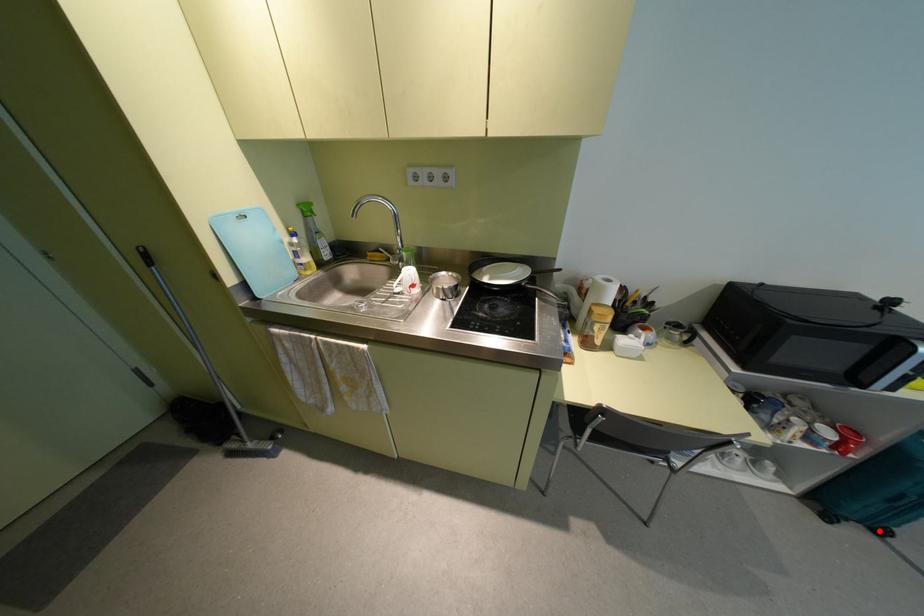
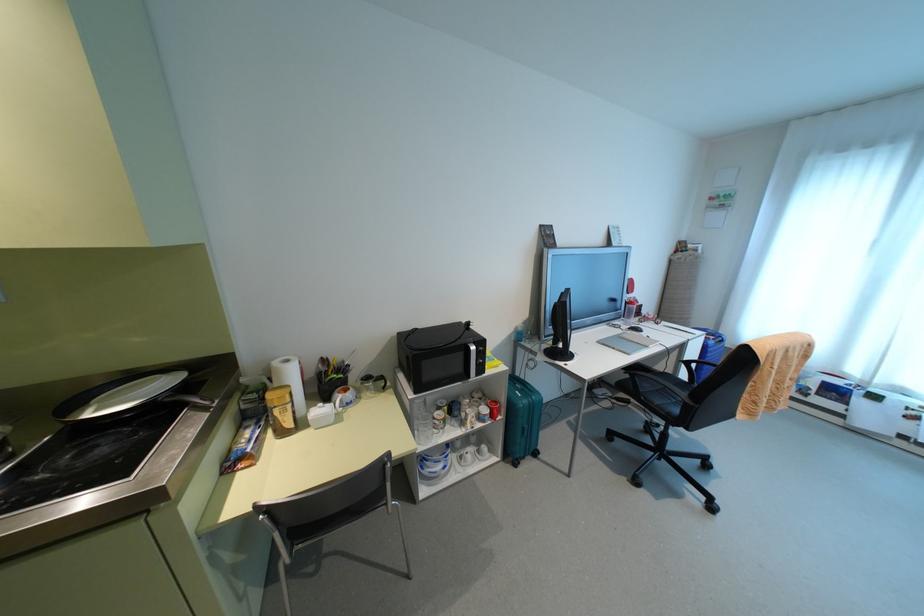
The point at the highlighted location is marked in the first image. Where is the corresponding point in the second image?

(535, 454)